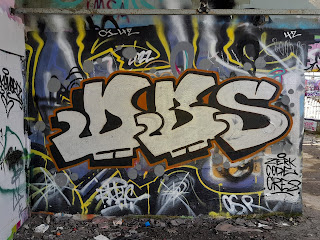
You are a GUI agent. You are given a task and a screenshot of the screen. Output one action in this format:
    pyautogui.click(x=<x>, y=<y>)
    Task: Click on the 1 middle wall
    The image size is (320, 240).
    Given the screenshot: What is the action you would take?
    pyautogui.click(x=219, y=179)